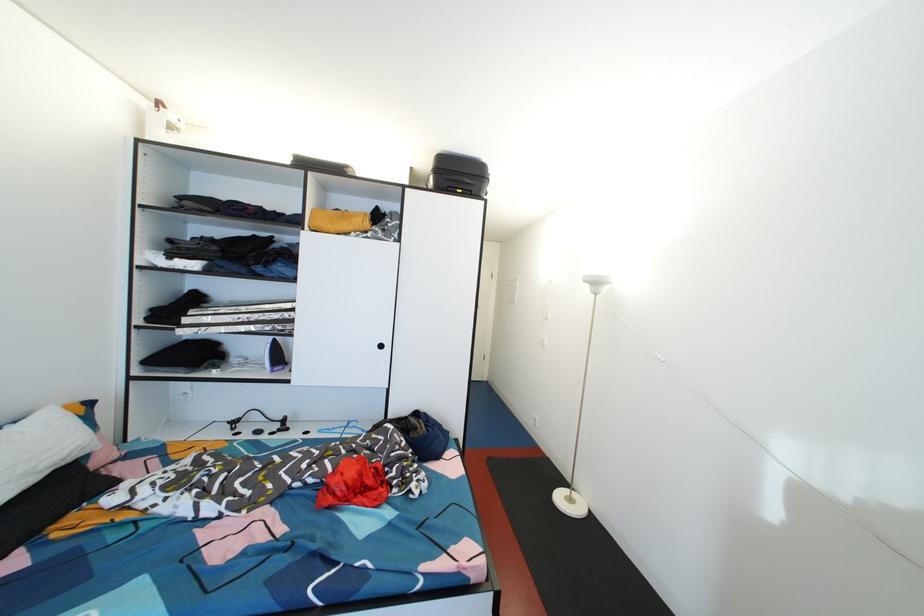
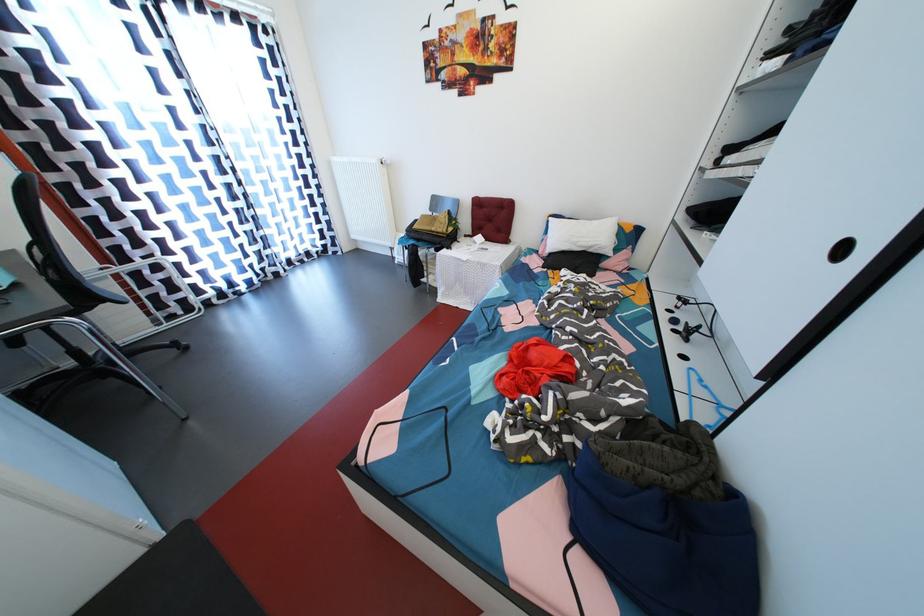
Find the pixel in the second image that matches pixel 73 458 in the first image.

(597, 249)